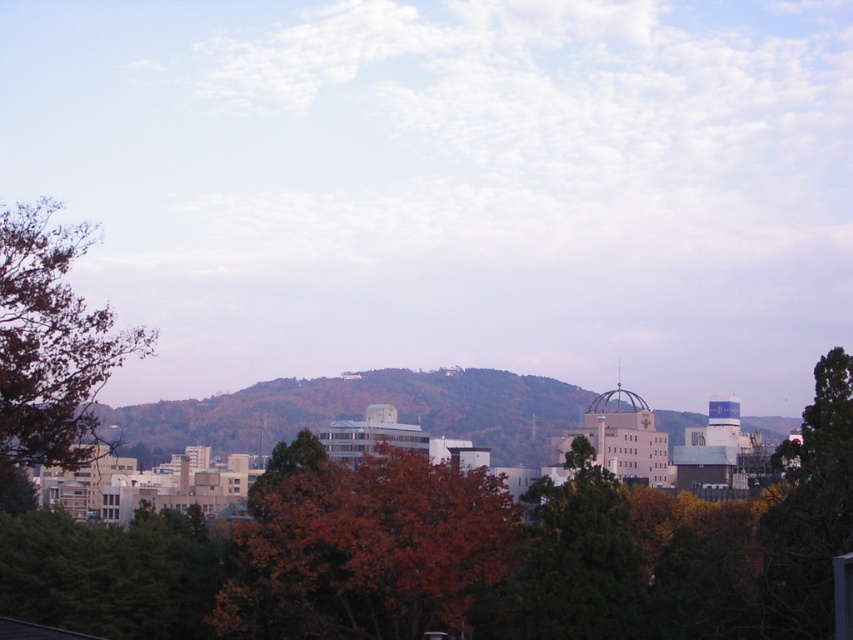
Can you confirm if orange matte tree at center is positioned below green leafy tree at right?

Yes.

Which of these two, orange matte tree at center or green leafy tree at right, stands taller?

green leafy tree at right is taller.

Image resolution: width=853 pixels, height=640 pixels. Identify the location of orange matte tree at center. (364, 547).

Is the position of green matte tree at center more distant than that of green leafy tree at right?

Yes.

How much distance is there between green matte tree at center and green leafy tree at right?

green matte tree at center and green leafy tree at right are 22.67 meters apart from each other.

Describe the element at coordinates (579, 557) in the screenshot. I see `green matte tree at center` at that location.

Where is `green matte tree at center`? Image resolution: width=853 pixels, height=640 pixels. green matte tree at center is located at coordinates (579, 557).

Does point (16, 445) lie in front of point (544, 516)?

Yes.

Who is more distant from viewer, (22, 429) or (582, 483)?

Point (582, 483)

Find the location of `brown leafy tree at left`. brown leafy tree at left is located at coordinates (51, 342).